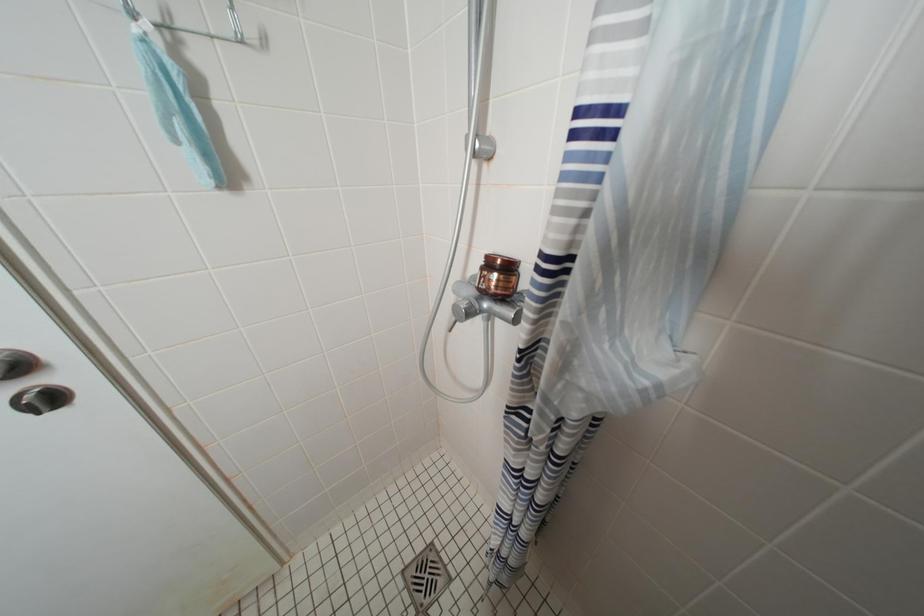
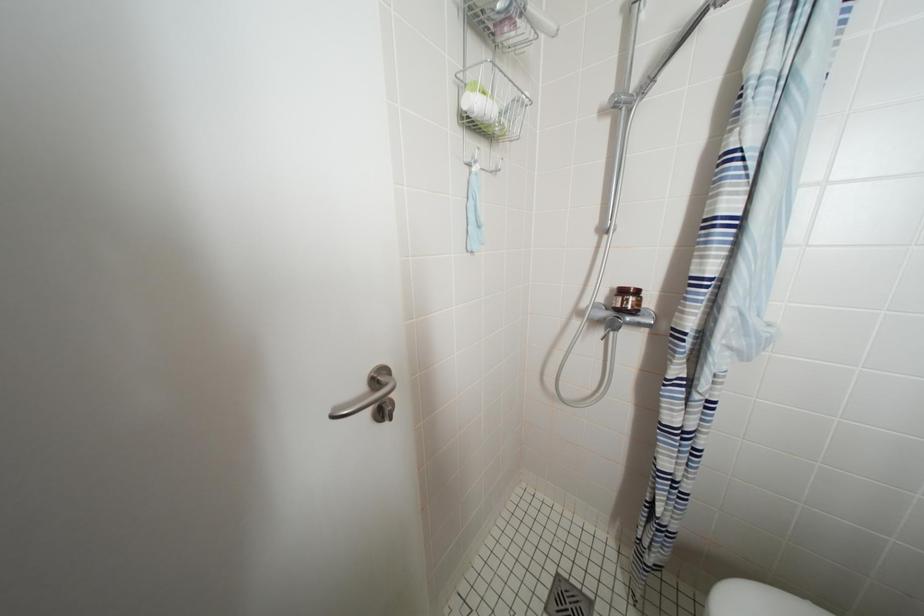
Question: The images are taken continuously from a first-person perspective. In which direction are you moving?

Choices:
 (A) Left
 (B) Right
 (C) Forward
 (D) Backward

Answer: (A)